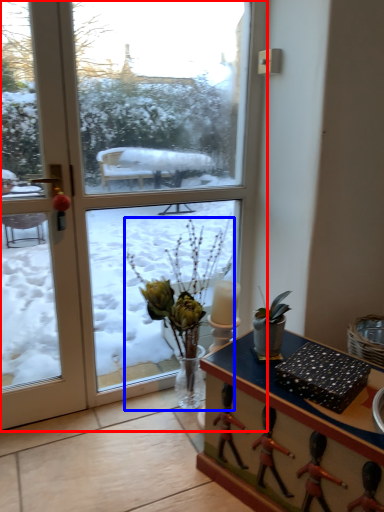
Question: Which of the following is the farthest to the observer, window (highlighted by a red box) or houseplant (highlighted by a blue box)?

Choices:
 (A) window
 (B) houseplant

Answer: (B)